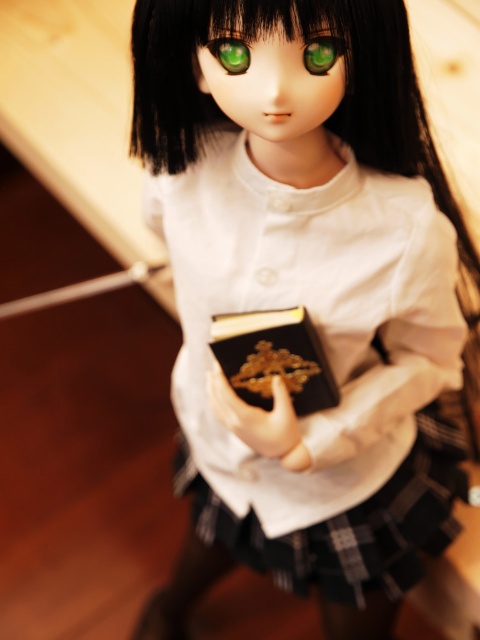
Question: Among these objects, which one is nearest to the camera?

Choices:
 (A) green glossy eye at upper center
 (B) green glossy eye at center
 (C) white matte uniform at center

Answer: (C)

Question: From the image, what is the correct spatial relationship of white matte uniform at center in relation to green glossy eye at center?

Choices:
 (A) right
 (B) left

Answer: (A)

Question: Which point appears closest to the camera in this image?

Choices:
 (A) (242, 61)
 (B) (224, 145)
 (C) (245, 314)
 (D) (277, 376)

Answer: (A)

Question: Does black leather book at center have a greater width compared to smooth gold ring at center?

Choices:
 (A) no
 (B) yes

Answer: (B)

Question: Does white matte uniform at center lie behind green glossy eye at center?

Choices:
 (A) no
 (B) yes

Answer: (A)

Question: Which object appears closest to the camera in this image?

Choices:
 (A) white matte uniform at center
 (B) green glossy eye at center
 (C) black leather book at center

Answer: (A)